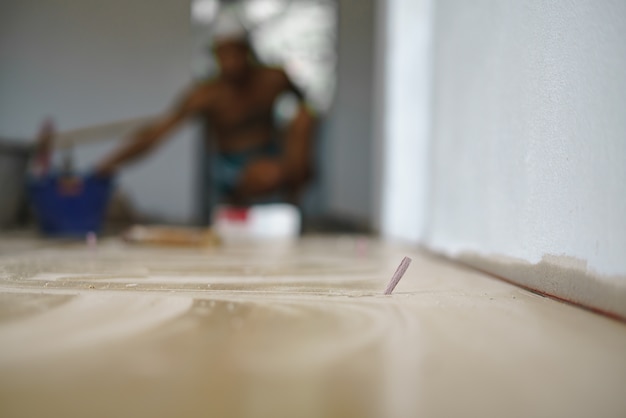
The image size is (626, 418). I want to click on cement floor, so click(178, 325).